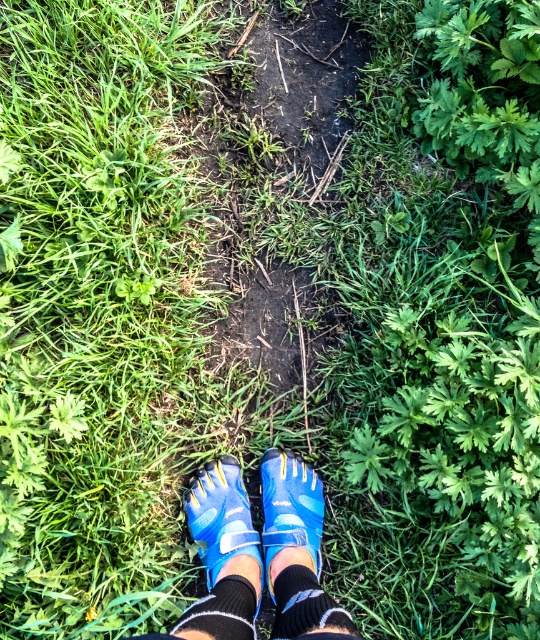
You are a drone operator trying to capture the best aerial shot of the path. You have two points marked on your map, point 1 at point (x=280, y=570) and point 2 at point (x=248, y=624). Which point is closer to the camera to ensure the path is in focus?

Point 1 at point (x=280, y=570) is closer to the camera than point 2 at point (x=248, y=624), so it will be in focus first.

You are a hiker whose foot is positioned on a narrow dirt path surrounded by greenery. You notice your blue synthetic shoe at lower center and black knit sock at lower center. Which item is closer to the ground?

The black knit sock at lower center is closer to the ground because the blue synthetic shoe at lower center is located above it.